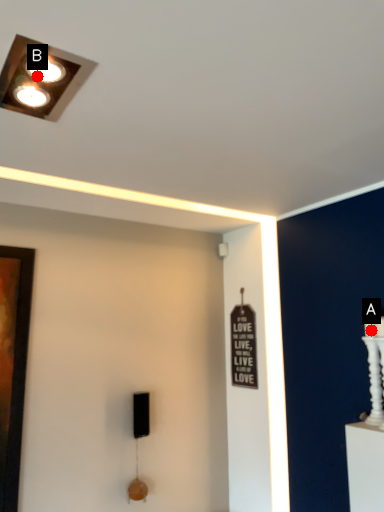
Question: Two points are circled on the image, labeled by A and B beside each circle. Which of the following is the farthest from the observer?

Choices:
 (A) A is further
 (B) B is further

Answer: (A)